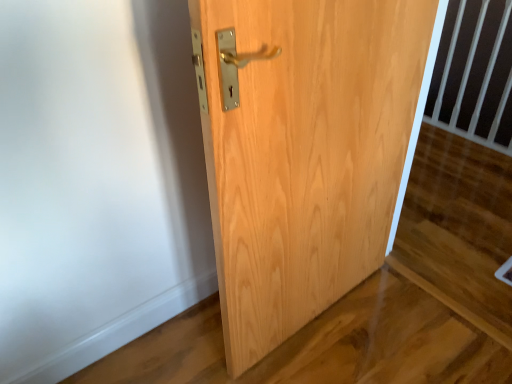
Identify the location of natural wood door at center. Image resolution: width=512 pixels, height=384 pixels. (303, 151).

The image size is (512, 384). What do you see at coordinates (303, 151) in the screenshot?
I see `natural wood door at center` at bounding box center [303, 151].

Where is `black plastic balustrade at upper right`? The width and height of the screenshot is (512, 384). black plastic balustrade at upper right is located at coordinates (475, 74).

Describe the element at coordinates (475, 74) in the screenshot. I see `black plastic balustrade at upper right` at that location.

What is the approximate height of black plastic balustrade at upper right?

black plastic balustrade at upper right is 78.26 centimeters in height.

Find the location of `natural wood door at center`. natural wood door at center is located at coordinates (303, 151).

Based on their positions, is natural wood door at center located to the left or right of black plastic balustrade at upper right?

natural wood door at center is positioned on black plastic balustrade at upper right's left side.

Does natural wood door at center lie behind black plastic balustrade at upper right?

No, natural wood door at center is in front of black plastic balustrade at upper right.

Is point (218, 91) closer or farther from the camera than point (467, 65)?

Point (218, 91) is closer to the camera than point (467, 65).

From the image's perspective, is natural wood door at center positioned above or below black plastic balustrade at upper right?

natural wood door at center is situated lower than black plastic balustrade at upper right in the image.

From a real-world perspective, which is physically below, natural wood door at center or black plastic balustrade at upper right?

black plastic balustrade at upper right is physically lower.

In terms of width, does natural wood door at center look wider or thinner when compared to black plastic balustrade at upper right?

In the image, natural wood door at center appears to be wider than black plastic balustrade at upper right.

Can you confirm if natural wood door at center is taller than black plastic balustrade at upper right?

Indeed, natural wood door at center has a greater height compared to black plastic balustrade at upper right.

Who is smaller, natural wood door at center or black plastic balustrade at upper right?

Smaller between the two is black plastic balustrade at upper right.

Is black plastic balustrade at upper right located within natural wood door at center?

Actually, black plastic balustrade at upper right is outside natural wood door at center.

Does natural wood door at center touch black plastic balustrade at upper right?

No, natural wood door at center is not making contact with black plastic balustrade at upper right.

Consider the image. Is natural wood door at center oriented towards black plastic balustrade at upper right?

No, natural wood door at center is not facing towards black plastic balustrade at upper right.

The image size is (512, 384). Identify the location of door below the black plastic balustrade at upper right (from the image's perspective). (303, 151).

Is black plastic balustrade at upper right at the right side of natural wood door at center?

Yes.

Is the position of black plastic balustrade at upper right more distant than that of natural wood door at center?

Yes, the depth of black plastic balustrade at upper right is greater than that of natural wood door at center.

Is point (468, 116) behind point (266, 308)?

Yes, it is.

From the image's perspective, would you say black plastic balustrade at upper right is positioned over natural wood door at center?

Correct, black plastic balustrade at upper right appears higher than natural wood door at center in the image.

From a real-world perspective, is black plastic balustrade at upper right physically located above or below natural wood door at center?

black plastic balustrade at upper right is below natural wood door at center.

Which object is thinner, black plastic balustrade at upper right or natural wood door at center?

With smaller width is black plastic balustrade at upper right.

Between black plastic balustrade at upper right and natural wood door at center, which one has more height?

Standing taller between the two is natural wood door at center.

Considering the sizes of objects black plastic balustrade at upper right and natural wood door at center in the image provided, who is smaller, black plastic balustrade at upper right or natural wood door at center?

black plastic balustrade at upper right is smaller.

Which is correct: black plastic balustrade at upper right is inside natural wood door at center, or outside of it?

black plastic balustrade at upper right exists outside the volume of natural wood door at center.

Is black plastic balustrade at upper right with natural wood door at center?

No, black plastic balustrade at upper right is not with natural wood door at center.

Is black plastic balustrade at upper right positioned with its back to natural wood door at center?

No, black plastic balustrade at upper right is not facing the opposite direction of natural wood door at center.

How different are the orientations of black plastic balustrade at upper right and natural wood door at center in degrees?

They differ by 91.6 degrees in their facing directions.

Identify the location of balustrade behind the natural wood door at center. (475, 74).

Locate an element on the screen. balustrade on the right of the natural wood door at center is located at coordinates (475, 74).

Locate an element on the screen. Image resolution: width=512 pixels, height=384 pixels. door that appears below the black plastic balustrade at upper right (from the image's perspective) is located at coordinates (303, 151).